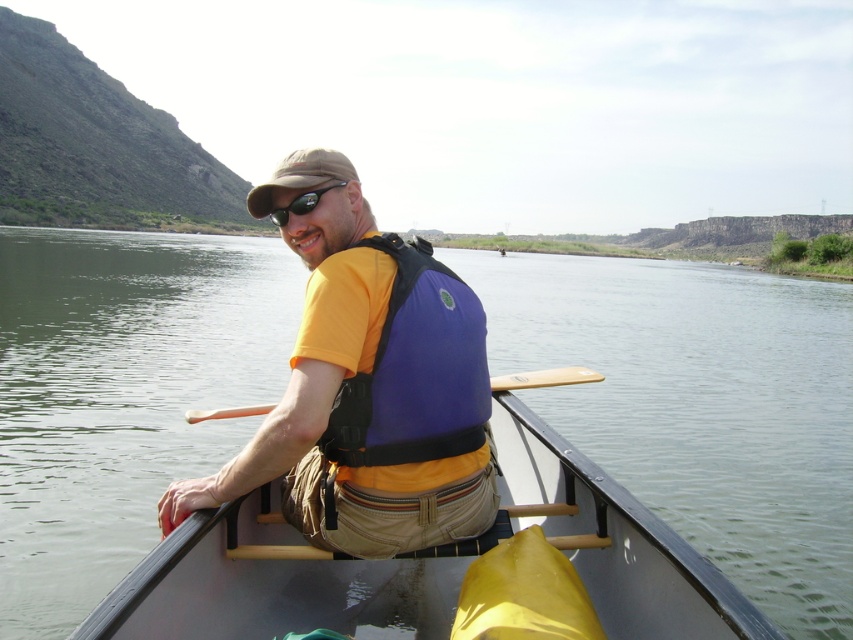
Question: Considering the real-world distances, which object is farthest from the black matte sunglasses at center?

Choices:
 (A) tan fabric baseball cap at upper center
 (B) yellow matte life vest at center
 (C) wooden paddle at center
 (D) smooth gray canoe at center

Answer: (C)

Question: Is yellow matte life vest at center thinner than tan fabric baseball cap at upper center?

Choices:
 (A) yes
 (B) no

Answer: (A)

Question: Estimate the real-world distances between objects in this image. Which object is farther from the wooden paddle at lower center?

Choices:
 (A) yellow matte life vest at center
 (B) smooth gray canoe at center

Answer: (B)

Question: Does smooth gray canoe at center appear under wooden paddle at lower center?

Choices:
 (A) yes
 (B) no

Answer: (B)

Question: Which object is farther from the camera taking this photo?

Choices:
 (A) tan fabric baseball cap at upper center
 (B) smooth gray canoe at center
 (C) yellow matte life vest at center
 (D) black matte sunglasses at center

Answer: (D)

Question: Is tan fabric baseball cap at upper center smaller than wooden paddle at lower center?

Choices:
 (A) yes
 (B) no

Answer: (B)